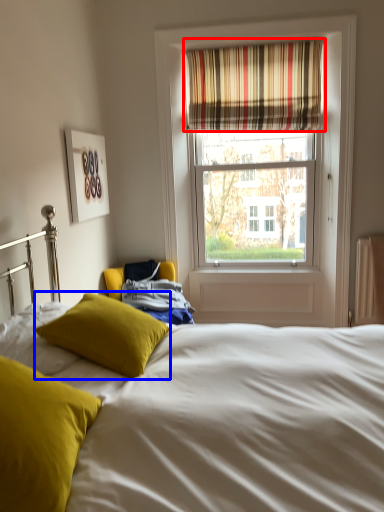
Question: Which of the following is the farthest to the observer, curtain (highlighted by a red box) or pillow (highlighted by a blue box)?

Choices:
 (A) curtain
 (B) pillow

Answer: (A)